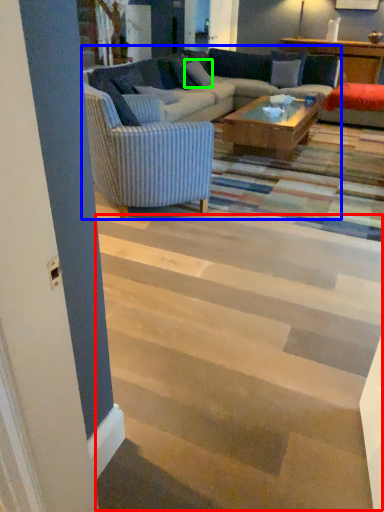
Question: Estimate the real-world distances between objects in this image. Which object is farther from stairwell (highlighted by a red box), studio couch (highlighted by a blue box) or pillow (highlighted by a green box)?

Choices:
 (A) studio couch
 (B) pillow

Answer: (B)